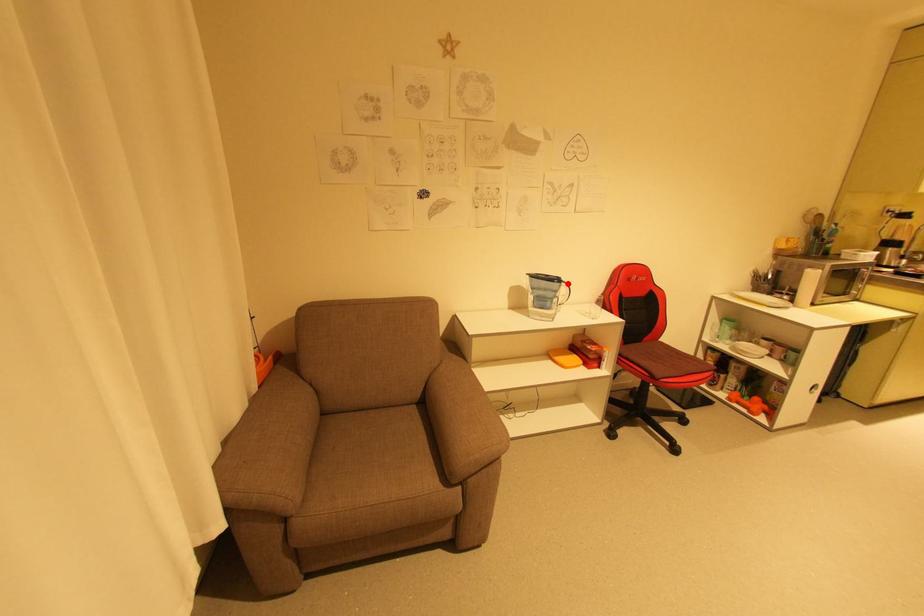
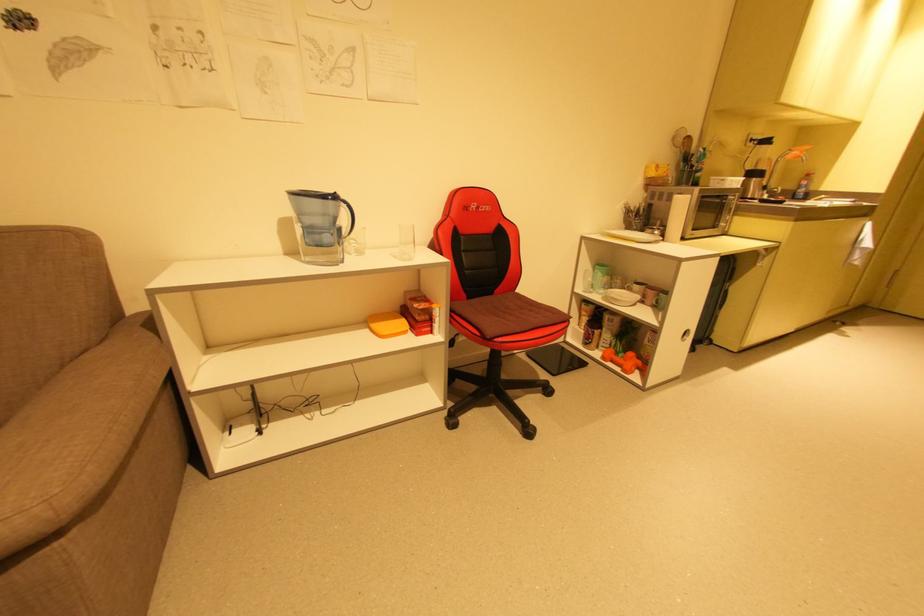
The point at the highlighted location is marked in the first image. Where is the corresponding point in the second image?

(346, 204)